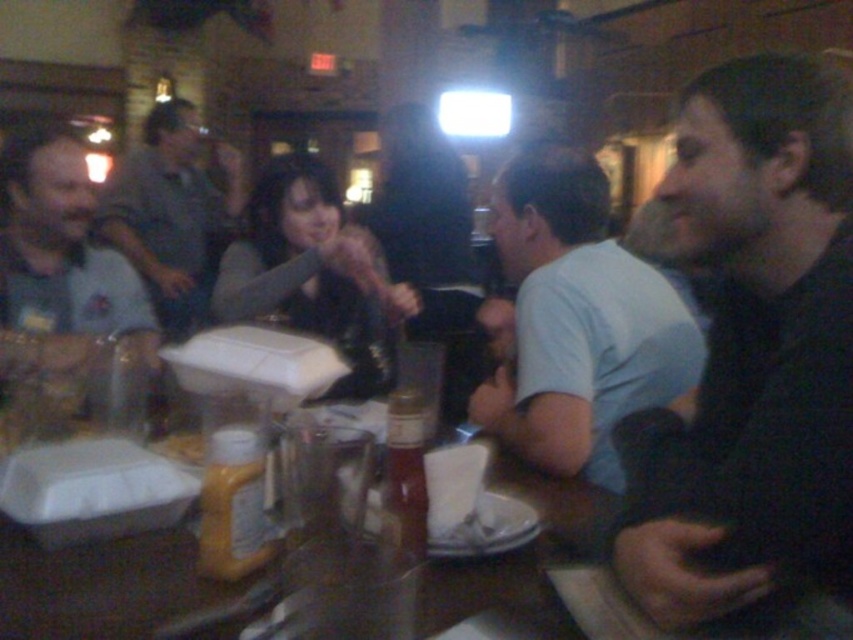
From the picture: What are the coordinates of the wooden table at center in the image?

The wooden table at center is located at coordinates point (109, 589).

You are sitting at the wooden table at center and want to grab the translucent plastic bottle at center. Which direction should you move to reach it?

The wooden table at center is to the left of the translucent plastic bottle at center, so you should move to your right to reach it.

You are standing at the entrance of the restaurant and want to find the wooden table at center. According to the coordinates given, where should you look to locate it?

The wooden table at center is located at the coordinates point (109, 589).